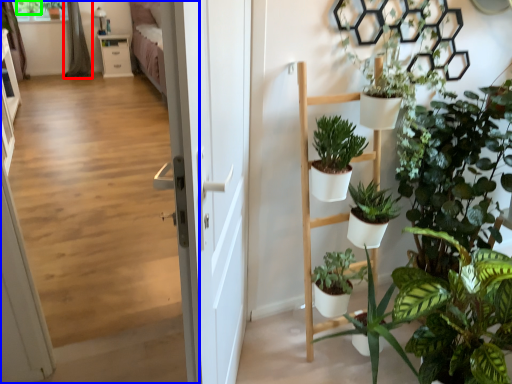
Question: Which object is the closest to the curtain (highlighted by a red box)? Choose among these: corridor (highlighted by a blue box) or plant (highlighted by a green box).

Choices:
 (A) corridor
 (B) plant

Answer: (B)